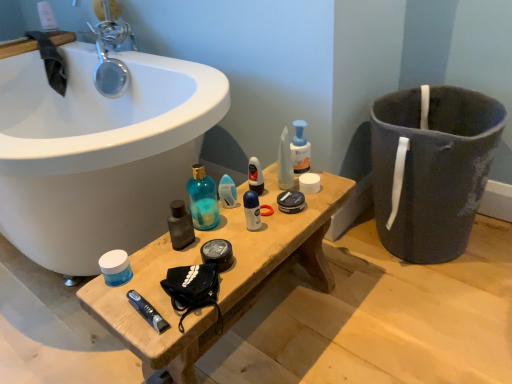
Find the location of a particular element. The image size is (512, 384). vacant space to the left of white matte deodorant at center, the 2th toiletry in the right-to-left sequence is located at coordinates (205, 235).